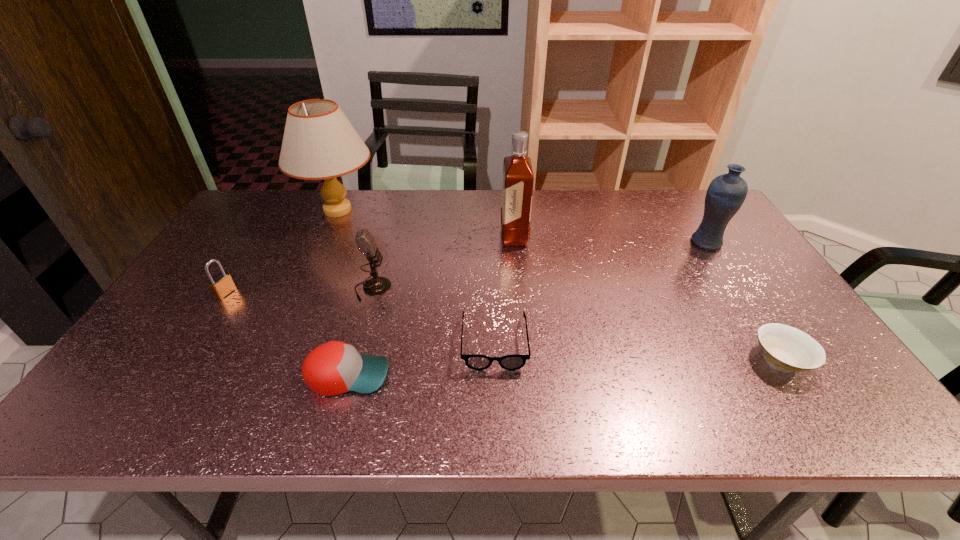
You are a GUI agent. You are given a task and a screenshot of the screen. Output one action in this format:
    pyautogui.click(x=<x>, y=<y>)
    Task: Click on the vacant region located 0.120m on the front label of the liquor
    The image size is (960, 540).
    Given the screenshot: What is the action you would take?
    pyautogui.click(x=463, y=236)

Where is `vacant area situated 0.070m on the front label of the liquor`? Image resolution: width=960 pixels, height=540 pixels. vacant area situated 0.070m on the front label of the liquor is located at coordinates (479, 236).

I want to click on blank space located 0.390m on the front label of the liquor, so click(x=377, y=236).

Where is `blank space located on the back of the sixth shortest object`? blank space located on the back of the sixth shortest object is located at coordinates (680, 200).

This screenshot has height=540, width=960. Find the location of `free region located 0.380m on the front-facing side of the fourth tallest object`. free region located 0.380m on the front-facing side of the fourth tallest object is located at coordinates (529, 289).

The height and width of the screenshot is (540, 960). In order to click on vacant space situated on the back of the padlock in this screenshot , I will do `click(250, 254)`.

The image size is (960, 540). I want to click on vacant space located at the brim of the baseball cap, so click(567, 375).

At what (x,y) coordinates should I click in order to perform the action: click on free spot located 0.400m on the left of the bowl. Please return your answer as a coordinate pair (x, y). The width and height of the screenshot is (960, 540). Looking at the image, I should click on (579, 360).

This screenshot has width=960, height=540. I want to click on vacant area located on the arms of the spectacles, so click(496, 422).

The width and height of the screenshot is (960, 540). In order to click on lampshade located in the far edge section of the desktop in this screenshot , I will do [x=319, y=142].